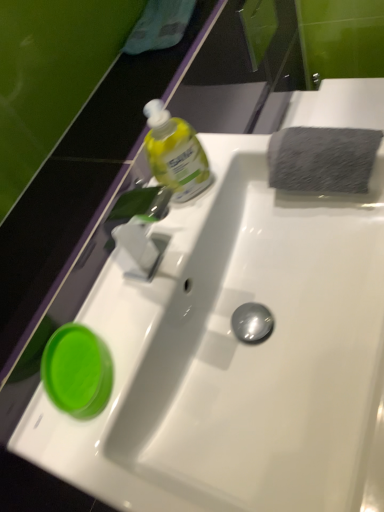
Question: Is translucent yellow liquid at upper center taller than white glossy sink at center?

Choices:
 (A) no
 (B) yes

Answer: (B)

Question: From a real-world perspective, is translucent yellow liquid at upper center positioned under white glossy sink at center based on gravity?

Choices:
 (A) yes
 (B) no

Answer: (B)

Question: Is translucent yellow liquid at upper center wider than white glossy sink at center?

Choices:
 (A) yes
 (B) no

Answer: (B)

Question: Is translucent yellow liquid at upper center facing towards white glossy sink at center?

Choices:
 (A) no
 (B) yes

Answer: (B)

Question: Is translucent yellow liquid at upper center in front of white glossy sink at center?

Choices:
 (A) no
 (B) yes

Answer: (A)

Question: Would you say green glossy cup at lower left is to the left or to the right of white glossy sink at center in the picture?

Choices:
 (A) left
 (B) right

Answer: (A)

Question: In terms of size, does green glossy cup at lower left appear bigger or smaller than white glossy sink at center?

Choices:
 (A) small
 (B) big

Answer: (A)

Question: Considering their positions, is green glossy cup at lower left located in front of or behind white glossy sink at center?

Choices:
 (A) front
 (B) behind

Answer: (B)

Question: In terms of width, does green glossy cup at lower left look wider or thinner when compared to white glossy sink at center?

Choices:
 (A) wide
 (B) thin

Answer: (B)

Question: Is gray textured sponge at upper right bigger or smaller than white glossy sink at center?

Choices:
 (A) small
 (B) big

Answer: (A)

Question: Relative to white glossy sink at center, is gray textured sponge at upper right in front or behind?

Choices:
 (A) behind
 (B) front

Answer: (A)

Question: Would you say gray textured sponge at upper right is to the left or to the right of white glossy sink at center in the picture?

Choices:
 (A) left
 (B) right

Answer: (B)

Question: Is gray textured sponge at upper right situated inside white glossy sink at center or outside?

Choices:
 (A) inside
 (B) outside

Answer: (A)

Question: Is white glossy sink at center taller or shorter than green glossy cup at lower left?

Choices:
 (A) tall
 (B) short

Answer: (A)

Question: Looking at their shapes, would you say white glossy sink at center is wider or thinner than green glossy cup at lower left?

Choices:
 (A) thin
 (B) wide

Answer: (B)